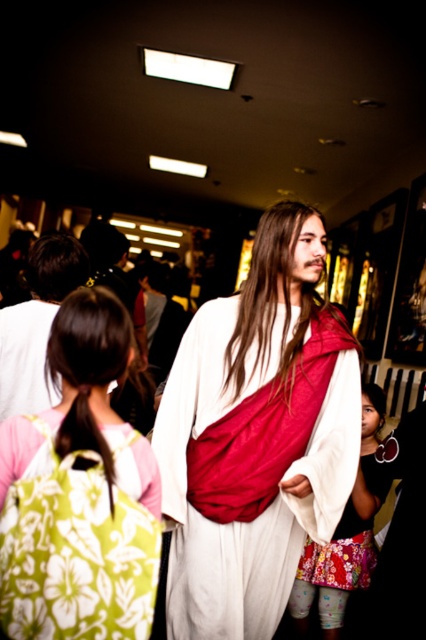
You are organizing a small event and need to place a decorative cloth on a table. The white cloth at center is available, but you also have the green floral backpack at lower left. Which item is larger in size?

The white cloth at center is larger in size compared to the green floral backpack at lower left.

You are at an indoor event and see the white matte dress at center and the floral fabric skirt at lower center. Which one is located to the left?

The white matte dress at center is positioned on the left side of the floral fabric skirt at lower center, so it is located to the left.

You are standing in the room and see the white matte dress at center and the white cloth at center. Which one is positioned more to the right side?

The white matte dress at center is positioned to the right of the white cloth at center, so it is more to the right side.